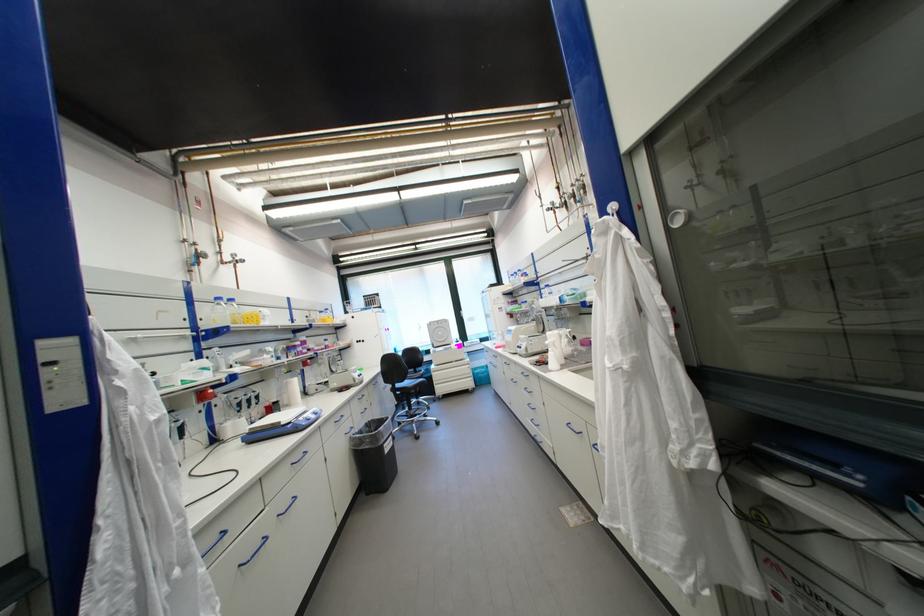
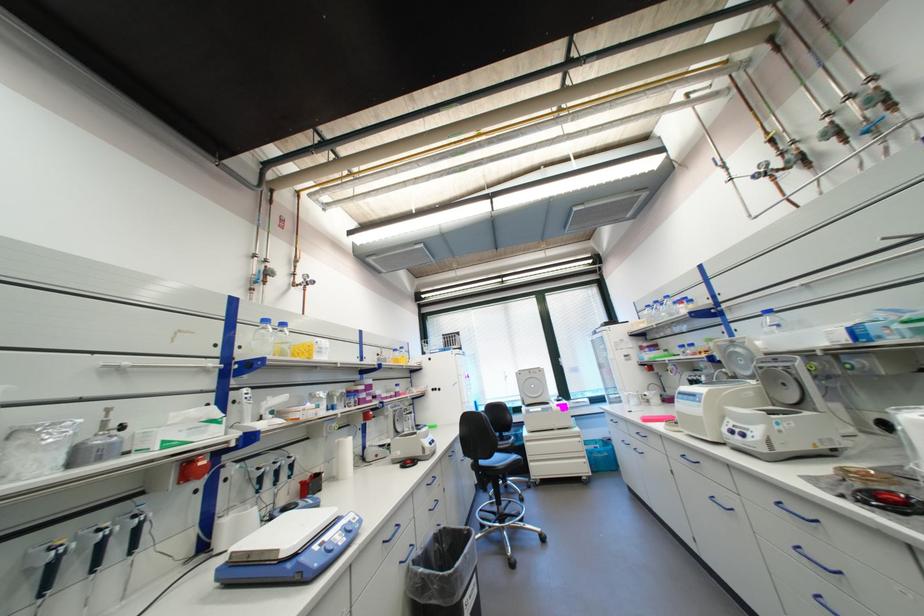
Find the pixel in the second image that matches [554,286] in the first image.

(776, 312)